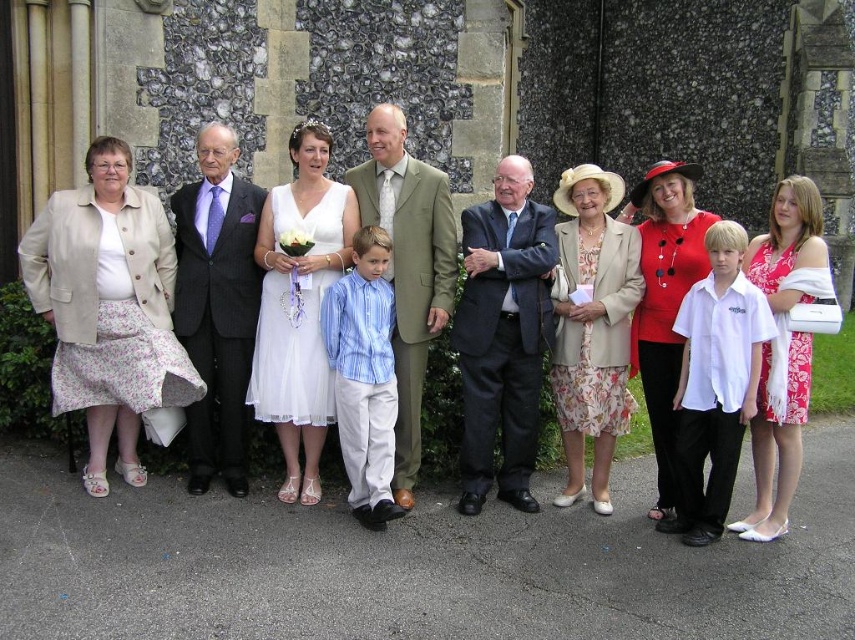
Question: Estimate the real-world distances between objects in this image. Which object is farther from the matte red blouse at center?

Choices:
 (A) floral cotton skirt at left
 (B) white tulle dress at center
 (C) floral print satin dress at center
 (D) white floral dress at center

Answer: (A)

Question: Is floral cotton skirt at left smaller than white chiffon dress at center?

Choices:
 (A) no
 (B) yes

Answer: (B)

Question: Which of the following is the closest to the observer?

Choices:
 (A) (805, 289)
 (B) (805, 417)

Answer: (A)

Question: Which object is the farthest from the white tulle dress at center?

Choices:
 (A) floral print dress at center
 (B) white chiffon dress at center
 (C) white floral dress at center

Answer: (C)

Question: Is floral print dress at center thinner than matte red blouse at center?

Choices:
 (A) yes
 (B) no

Answer: (A)

Question: Is dark blue suit at center to the left of green textured suit at center from the viewer's perspective?

Choices:
 (A) no
 (B) yes

Answer: (A)